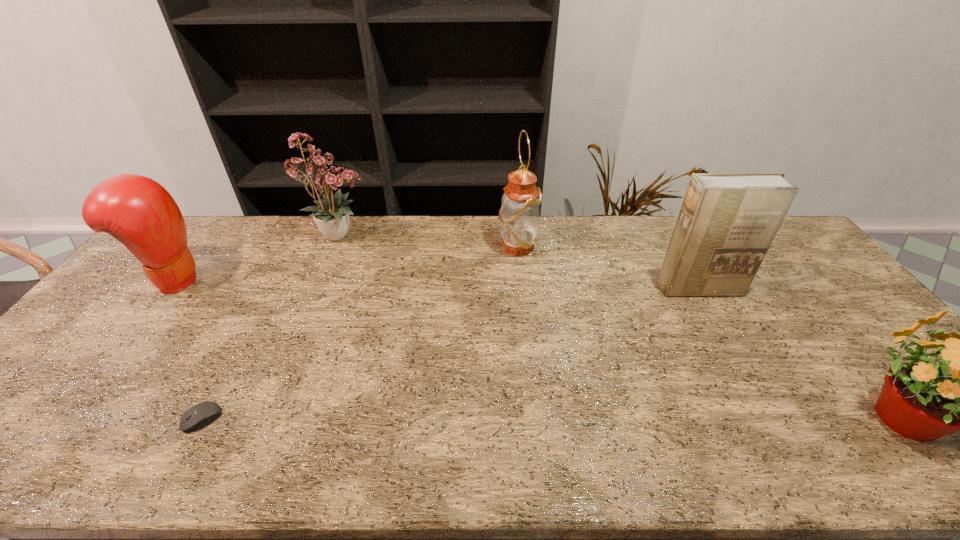
This screenshot has width=960, height=540. Identify the location of the third object from right to left. (519, 215).

Identify the location of flower arrangement. This screenshot has width=960, height=540. [332, 215].

You are a GUI agent. You are given a task and a screenshot of the screen. Output one action in this format:
    pyautogui.click(x=<x>, y=<y>)
    Task: Click on the fifth object from left to right
    
    Given the screenshot: What is the action you would take?
    pyautogui.click(x=727, y=222)

You are a GUI agent. You are given a task and a screenshot of the screen. Output one action in this format:
    pyautogui.click(x=<x>, y=<y>)
    Task: Click on the boxing glove
    
    Given the screenshot: What is the action you would take?
    pyautogui.click(x=137, y=211)

Locate an element on the screen. computer equipment is located at coordinates (200, 415).

I want to click on free space located 0.080m on the front of the oil lamp, so click(520, 275).

Image resolution: width=960 pixels, height=540 pixels. I want to click on vacant space situated 0.300m on the front-facing side of the flower arrangement, so click(464, 235).

At what (x,y) coordinates should I click in order to perform the action: click on vacant space located on the cover of the phonebook. Please return your answer as a coordinate pair (x, y). The height and width of the screenshot is (540, 960). Looking at the image, I should click on (722, 333).

Where is `vacant space situated on the striking surface of the leftmost object`? The height and width of the screenshot is (540, 960). vacant space situated on the striking surface of the leftmost object is located at coordinates (233, 280).

At what (x,y) coordinates should I click in order to perform the action: click on free space located on the right of the computer equipment. Please return your answer as a coordinate pair (x, y). Looking at the image, I should click on (386, 419).